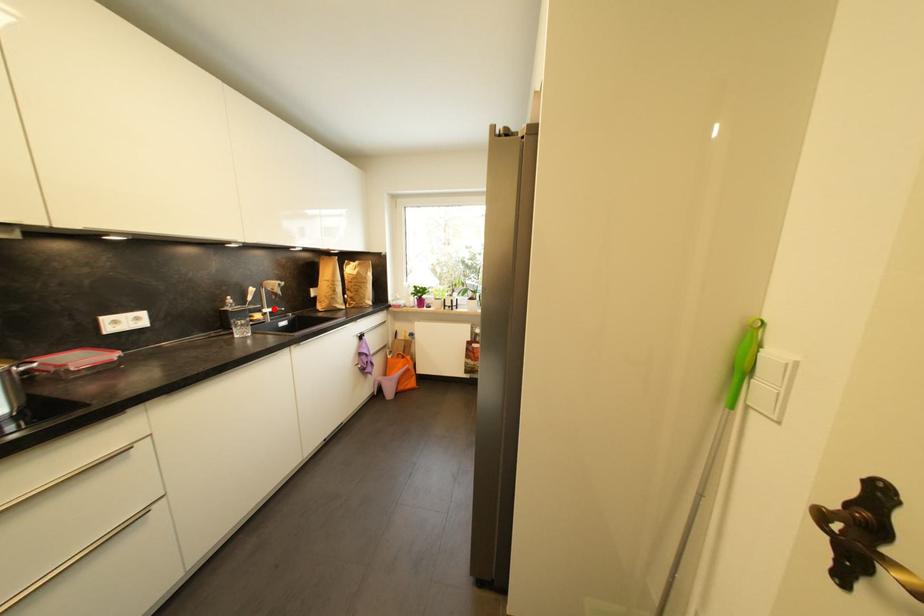
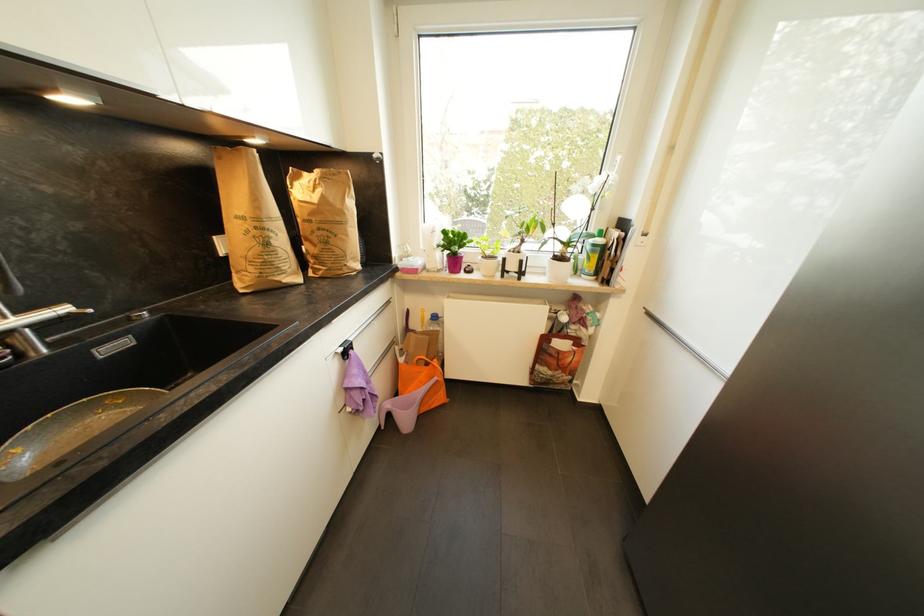
Where in the second image is the point corresponding to the highlighted location from the first image?

(27, 313)